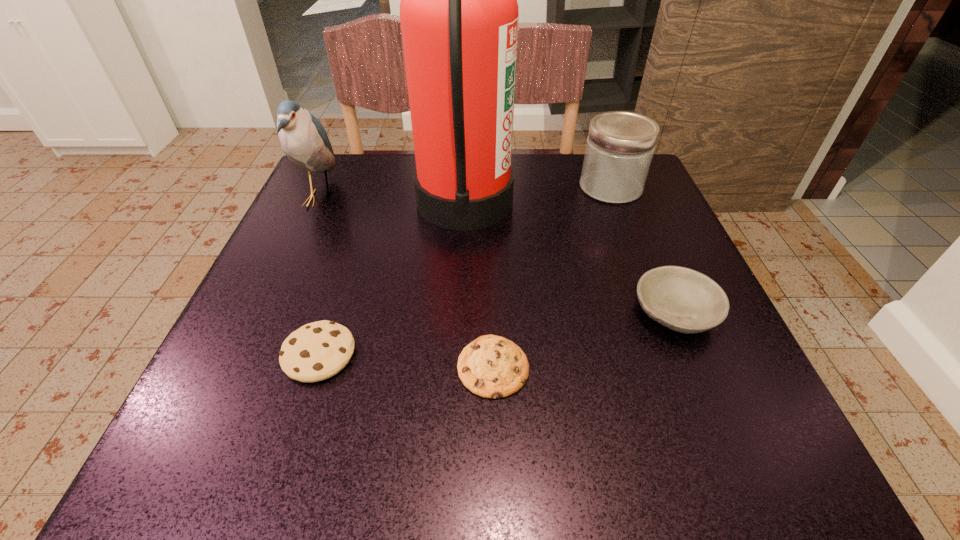
Where is `vacant space situated at the tip of the fifth shortest object's beak`? The image size is (960, 540). vacant space situated at the tip of the fifth shortest object's beak is located at coordinates (359, 198).

Identify the location of free point located 0.390m on the left of the jar. (415, 187).

This screenshot has width=960, height=540. Find the location of `free space located 0.270m on the back of the bowl`. free space located 0.270m on the back of the bowl is located at coordinates (628, 200).

Locate an element on the screen. The height and width of the screenshot is (540, 960). vacant region located on the right of the taller cookie is located at coordinates (532, 354).

This screenshot has width=960, height=540. I want to click on free point located on the back of the right cookie, so 490,228.

Where is `fire extinguisher at the far edge`? fire extinguisher at the far edge is located at coordinates (459, 15).

Image resolution: width=960 pixels, height=540 pixels. In order to click on bird located at the far edge in this screenshot , I will do `click(304, 140)`.

At what (x,y) coordinates should I click in order to perform the action: click on jar that is positioned at the far edge. Please return your answer as a coordinate pair (x, y). The image size is (960, 540). Looking at the image, I should click on (620, 145).

Locate an element on the screen. This screenshot has width=960, height=540. bird at the left edge is located at coordinates (304, 140).

Image resolution: width=960 pixels, height=540 pixels. Find the location of `cookie that is at the left edge`. cookie that is at the left edge is located at coordinates (316, 351).